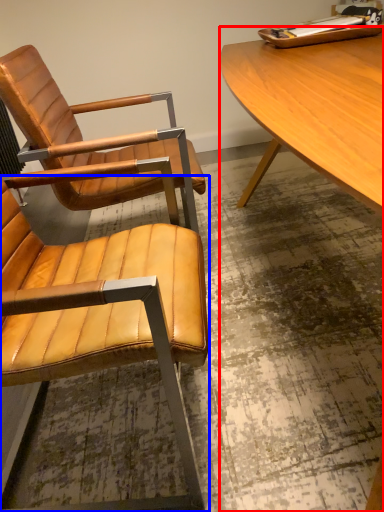
Question: Which point is further to the camera, desk (highlighted by a red box) or chair (highlighted by a blue box)?

Choices:
 (A) desk
 (B) chair

Answer: (B)